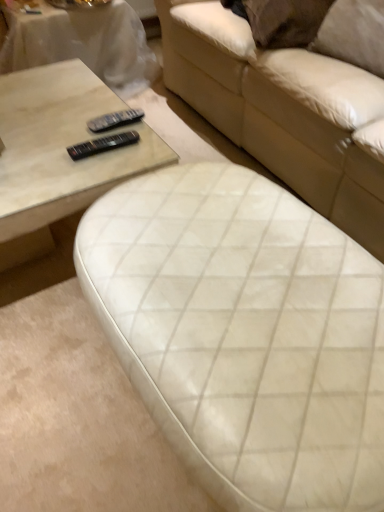
Question: Looking at the image, does black plastic remote at upper center, which is the second remote in bottom-to-top order, seem bigger or smaller compared to white quilted leather ottoman at center, the 1th studio couch in the bottom-to-top sequence?

Choices:
 (A) big
 (B) small

Answer: (B)

Question: Is black plastic remote at upper center, which is the second remote in bottom-to-top order, to the left or to the right of white quilted leather ottoman at center, the 1th studio couch in the bottom-to-top sequence, in the image?

Choices:
 (A) left
 (B) right

Answer: (A)

Question: Estimate the real-world distances between objects in this image. Which object is closer to the white quilted leather ottoman at center, acting as the second studio couch starting from the top?

Choices:
 (A) matte glass coffee table at center
 (B) white quilted fabric studio couch at center, which is the 2th studio couch in bottom-to-top order
 (C) black plastic remote at center, which is counted as the 1th remote, starting from the bottom
 (D) matte white coffee table at upper left
 (E) black plastic remote at upper center, acting as the 1th remote starting from the top

Answer: (A)

Question: Estimate the real-world distances between objects in this image. Which object is farther from the white quilted fabric studio couch at center, marked as the first studio couch in a top-to-bottom arrangement?

Choices:
 (A) black plastic remote at center, the second remote positioned from the top
 (B) black plastic remote at upper center, acting as the 1th remote starting from the top
 (C) matte white coffee table at upper left
 (D) matte glass coffee table at center
 (E) white quilted leather ottoman at center, the 1th studio couch in the bottom-to-top sequence

Answer: (A)